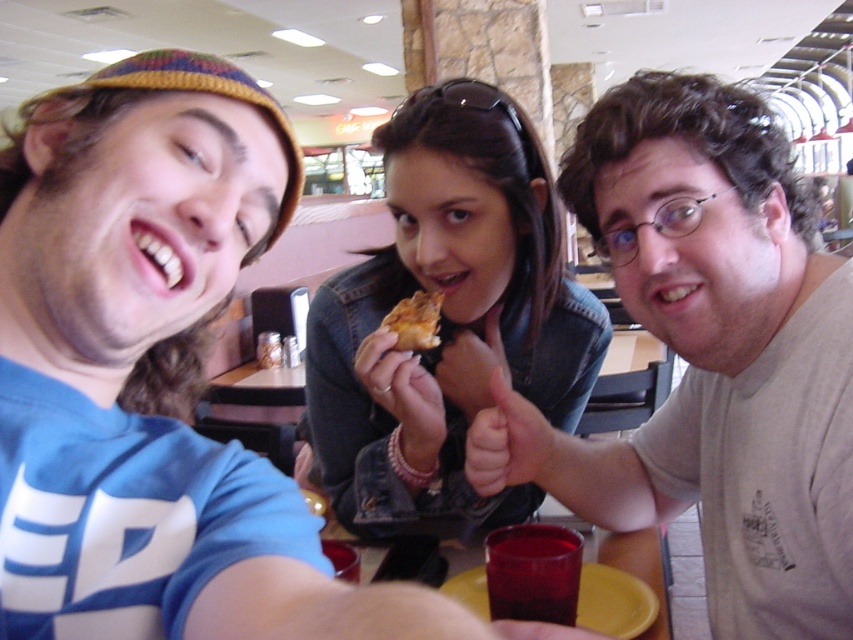
You are a photographer standing at the entrance of the pizza restaurant. You see two points marked on the floor, point 1 at coordinates point (65, 612) and point 2 at coordinates point (392, 330). Which point is closer to you?

Point (65, 612) is in front of point (392, 330), so it is closer to you.